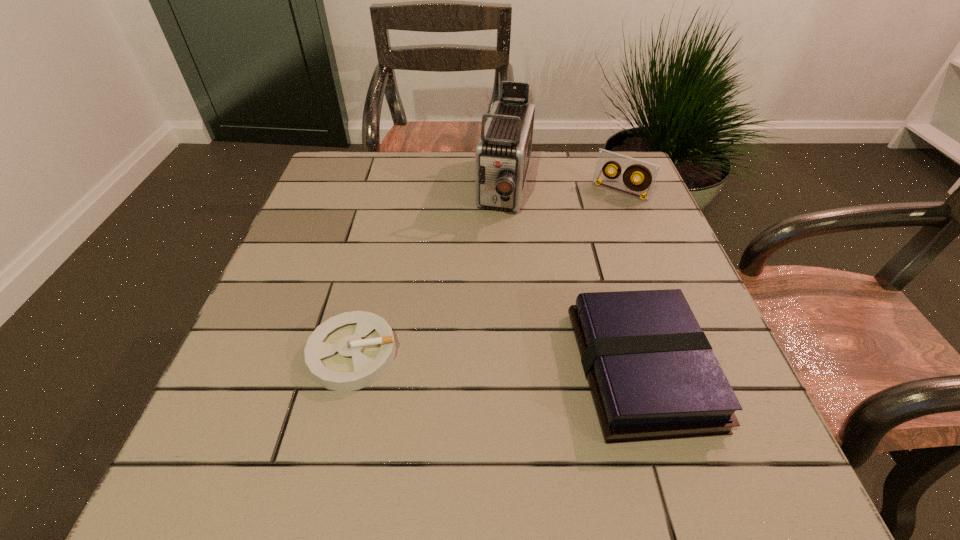
Locate which object ranks third in proximity to the videotape. Please provide its 2D coordinates. Your answer should be formatted as a tuple, i.e. [(x, y)], where the tuple contains the x and y coordinates of a point satisfying the conditions above.

[(349, 351)]

At what (x,y) coordinates should I click in order to perform the action: click on vacant space that satisfies the following two spatial constraints: 1. on the front side of the book; 2. on the right side of the shortest object. Please return your answer as a coordinate pair (x, y). This screenshot has width=960, height=540. Looking at the image, I should click on (349, 369).

Find the location of a particular element. free space that satisfies the following two spatial constraints: 1. on the front side of the leftmost object; 2. on the left side of the second shortest object is located at coordinates [x=349, y=369].